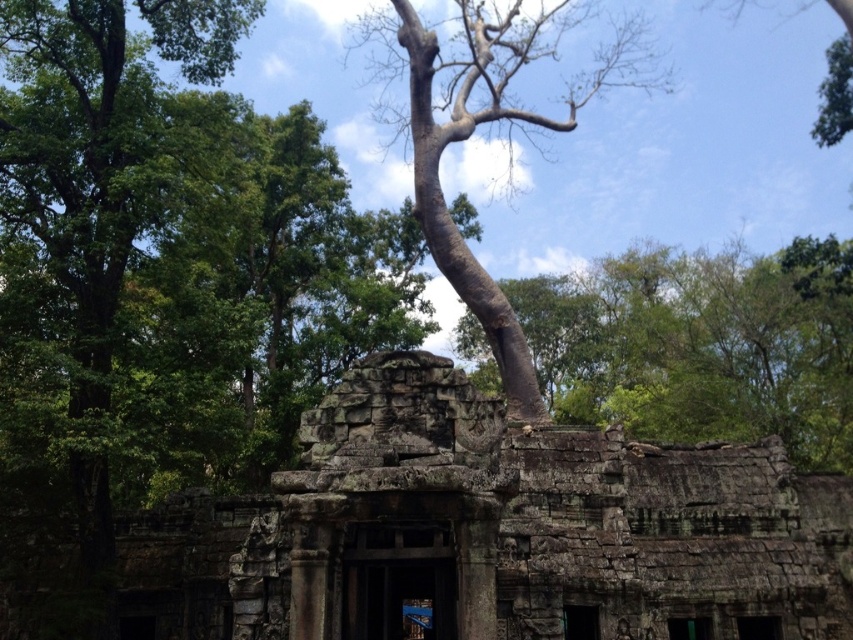
Question: Observing the image, what is the correct spatial positioning of brown rough tree trunk at center in reference to bark textured tree at center?

Choices:
 (A) right
 (B) left

Answer: (A)

Question: Which point is farther from the camera taking this photo?

Choices:
 (A) (525, 369)
 (B) (780, 500)
 (C) (624, 268)

Answer: (C)

Question: Which object is the closest to the bark textured tree at center?

Choices:
 (A) weathered stone ruins at center
 (B) brown rough tree trunk at center

Answer: (B)

Question: Among these points, which one is nearest to the camera?

Choices:
 (A) (547, 403)
 (B) (310, 628)

Answer: (B)

Question: Is weathered stone ruins at center bigger than bark textured tree at center?

Choices:
 (A) yes
 (B) no

Answer: (B)

Question: Does brown rough tree trunk at center appear on the right side of bark textured tree at center?

Choices:
 (A) no
 (B) yes

Answer: (B)